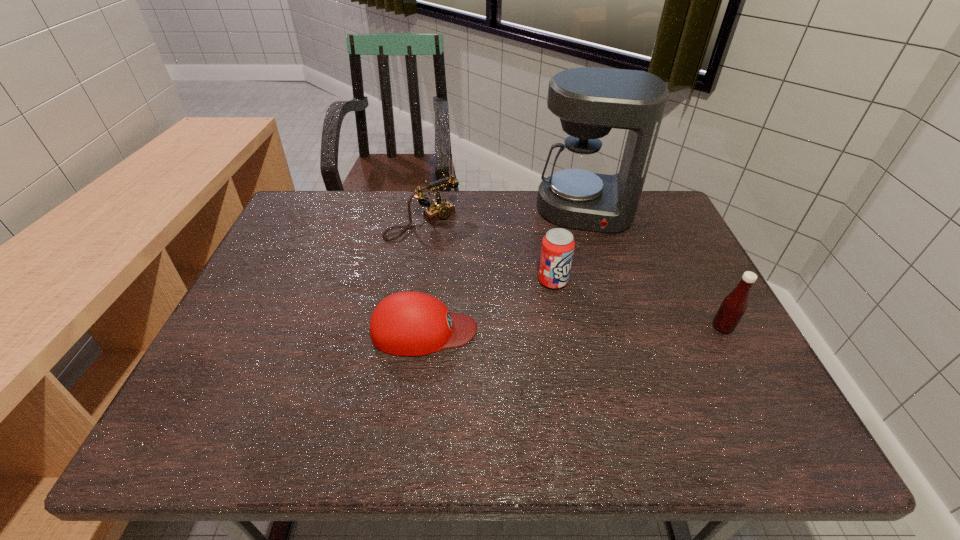
Locate an element on the screen. free space on the desktop that is between the baseball cap and the Tabasco sauce and is positioned on the front-facing side of the telephone is located at coordinates (541, 329).

Image resolution: width=960 pixels, height=540 pixels. I want to click on free spot on the desktop that is between the baseball cap and the Tabasco sauce and is positioned on the surface of the third farthest object, so click(613, 328).

You are a GUI agent. You are given a task and a screenshot of the screen. Output one action in this format:
    pyautogui.click(x=<x>, y=<y>)
    Task: Click on the vacant space on the desktop that is between the shortest object and the rightmost object and is positioned on the front-facing side of the tallest object
    Image resolution: width=960 pixels, height=540 pixels.
    Given the screenshot: What is the action you would take?
    pyautogui.click(x=576, y=329)